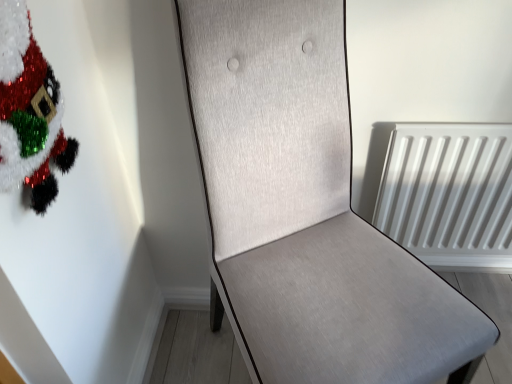
Find the location of a particular element. The image size is (512, 384). light gray fabric chair at center is located at coordinates (307, 209).

What do you see at coordinates (307, 209) in the screenshot? The width and height of the screenshot is (512, 384). I see `light gray fabric chair at center` at bounding box center [307, 209].

Where is `fuzzy tinsel santa at upper left`? Image resolution: width=512 pixels, height=384 pixels. fuzzy tinsel santa at upper left is located at coordinates (29, 112).

The image size is (512, 384). Describe the element at coordinates (29, 112) in the screenshot. I see `fuzzy tinsel santa at upper left` at that location.

Where is `light gray fabric chair at center`? light gray fabric chair at center is located at coordinates (307, 209).

Which is more to the right, fuzzy tinsel santa at upper left or light gray fabric chair at center?

Positioned to the right is light gray fabric chair at center.

Consider the image. Which object is further away from the camera, fuzzy tinsel santa at upper left or light gray fabric chair at center?

fuzzy tinsel santa at upper left is further from the camera.

Which point is more distant from viewer, (0, 20) or (315, 175)?

The point (315, 175) is more distant.

From the image's perspective, which is above, fuzzy tinsel santa at upper left or light gray fabric chair at center?

fuzzy tinsel santa at upper left appears higher in the image.

From a real-world perspective, is fuzzy tinsel santa at upper left physically above light gray fabric chair at center?

Yes, from a real-world perspective, fuzzy tinsel santa at upper left is above light gray fabric chair at center.

Considering the sizes of objects fuzzy tinsel santa at upper left and light gray fabric chair at center in the image provided, who is thinner, fuzzy tinsel santa at upper left or light gray fabric chair at center?

fuzzy tinsel santa at upper left.

Who is taller, fuzzy tinsel santa at upper left or light gray fabric chair at center?

With more height is light gray fabric chair at center.

Which of these two, fuzzy tinsel santa at upper left or light gray fabric chair at center, is bigger?

light gray fabric chair at center is bigger.

Would you say fuzzy tinsel santa at upper left is outside light gray fabric chair at center?

Indeed, fuzzy tinsel santa at upper left is completely outside light gray fabric chair at center.

Is fuzzy tinsel santa at upper left placed right next to light gray fabric chair at center?

fuzzy tinsel santa at upper left and light gray fabric chair at center are clearly separated.

Is fuzzy tinsel santa at upper left aimed at light gray fabric chair at center?

Yes, fuzzy tinsel santa at upper left is aimed at light gray fabric chair at center.

Identify the location of christmas tree that is above the light gray fabric chair at center (from the image's perspective). (29, 112).

Considering the positions of objects light gray fabric chair at center and fuzzy tinsel santa at upper left in the image provided, who is more to the right, light gray fabric chair at center or fuzzy tinsel santa at upper left?

From the viewer's perspective, light gray fabric chair at center appears more on the right side.

Which object is more forward, light gray fabric chair at center or fuzzy tinsel santa at upper left?

Positioned in front is light gray fabric chair at center.

Is point (345, 264) closer or farther from the camera than point (14, 35)?

Point (345, 264) is farther from the camera than point (14, 35).

From the image's perspective, is light gray fabric chair at center over fuzzy tinsel santa at upper left?

No, from the image's perspective, light gray fabric chair at center is not over fuzzy tinsel santa at upper left.

From a real-world perspective, who is located lower, light gray fabric chair at center or fuzzy tinsel santa at upper left?

light gray fabric chair at center.

Considering the relative sizes of light gray fabric chair at center and fuzzy tinsel santa at upper left in the image provided, is light gray fabric chair at center thinner than fuzzy tinsel santa at upper left?

Incorrect, the width of light gray fabric chair at center is not less than that of fuzzy tinsel santa at upper left.

Can you confirm if light gray fabric chair at center is taller than fuzzy tinsel santa at upper left?

Yes, light gray fabric chair at center is taller than fuzzy tinsel santa at upper left.

Which of these two, light gray fabric chair at center or fuzzy tinsel santa at upper left, is smaller?

Smaller between the two is fuzzy tinsel santa at upper left.

Is light gray fabric chair at center surrounding fuzzy tinsel santa at upper left?

No, fuzzy tinsel santa at upper left is not inside light gray fabric chair at center.

Is light gray fabric chair at center far away from fuzzy tinsel santa at upper left?

No, light gray fabric chair at center is in close proximity to fuzzy tinsel santa at upper left.

Is light gray fabric chair at center turned away from fuzzy tinsel santa at upper left?

light gray fabric chair at center is not turned away from fuzzy tinsel santa at upper left.

Consider the image. What's the angular difference between light gray fabric chair at center and fuzzy tinsel santa at upper left's facing directions?

62.1 degrees separate the facing orientations of light gray fabric chair at center and fuzzy tinsel santa at upper left.

Measure the distance from light gray fabric chair at center to fuzzy tinsel santa at upper left.

A distance of 45.85 centimeters exists between light gray fabric chair at center and fuzzy tinsel santa at upper left.

Identify the location of christmas tree located on the left of light gray fabric chair at center. The width and height of the screenshot is (512, 384). (29, 112).

Identify the location of christmas tree to the left of light gray fabric chair at center. This screenshot has height=384, width=512. (29, 112).

Locate an element on the screen. Image resolution: width=512 pixels, height=384 pixels. christmas tree that is above the light gray fabric chair at center (from a real-world perspective) is located at coordinates (29, 112).